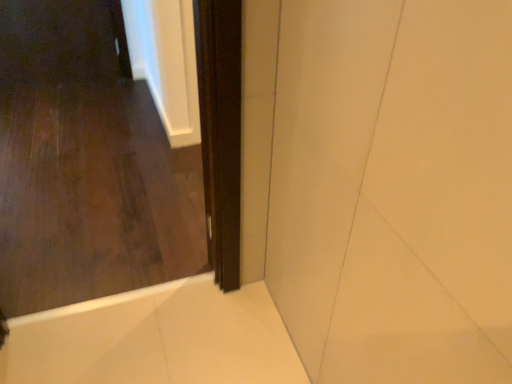
Where is `free spot in front of dark wood door at center`? free spot in front of dark wood door at center is located at coordinates (96, 352).